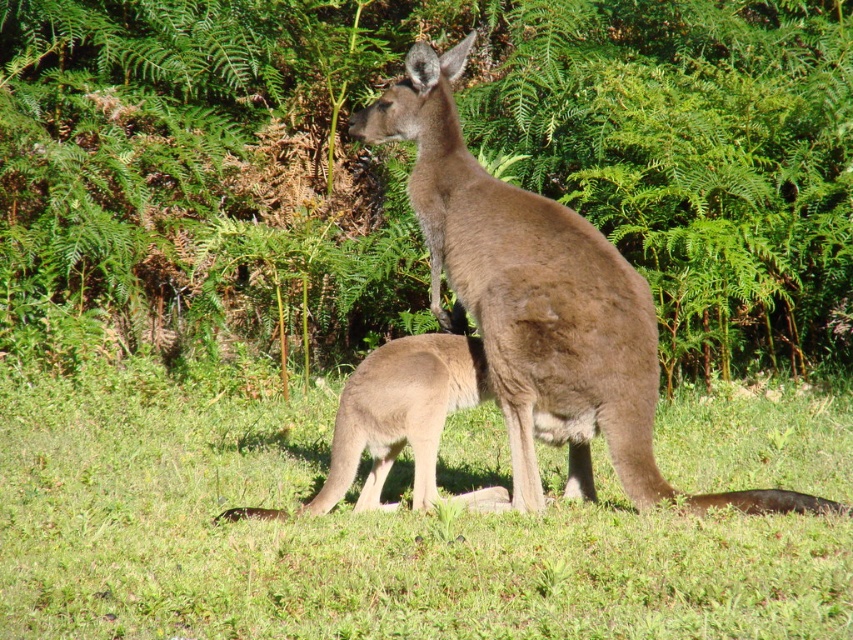
You are a photographer trying to capture the kangaroo and its joey. You notice the green leafy foliage at center and the green grassy at center in the background. Which object should you adjust your camera focus to if you want to highlight the kangaroo and joey more clearly?

The green leafy foliage at center is positioned on the right side of green grassy at center. To highlight the kangaroo and joey, focus on the green grassy at center since it is closer to the main subjects.

Looking at this image, you are a photographer trying to capture a clear shot of the brown furry kangaroo at center and the green grassy at center. From your current position, which object is more to the left?

The green grassy at center is positioned on the left side of brown furry kangaroo at center, so the green grassy at center is more to the left.